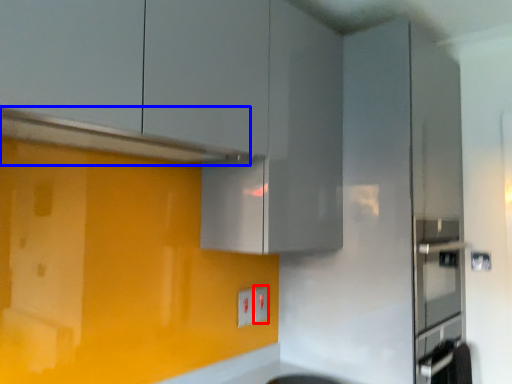
Question: Among these objects, which one is nearest to the camera, electric outlet (highlighted by a red box) or exhaust hood (highlighted by a blue box)?

Choices:
 (A) electric outlet
 (B) exhaust hood

Answer: (B)